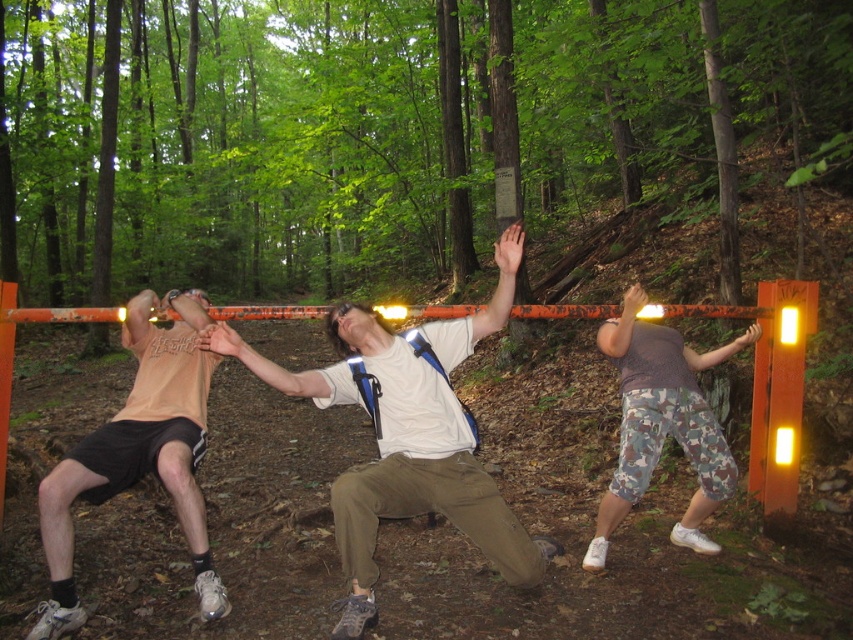
Question: Is matte peach t-shirt at left wider than camo pants at center?

Choices:
 (A) no
 (B) yes

Answer: (A)

Question: In this image, where is white matte t-shirt at center located relative to camo pants at center?

Choices:
 (A) below
 (B) above

Answer: (A)

Question: Is matte peach t-shirt at left to the right of camo pants at center from the viewer's perspective?

Choices:
 (A) yes
 (B) no

Answer: (B)

Question: Which object appears closest to the camera in this image?

Choices:
 (A) camo pants at center
 (B) white matte t-shirt at center
 (C) matte peach t-shirt at left

Answer: (B)

Question: Which of the following is the closest to the observer?

Choices:
 (A) (123, 483)
 (B) (376, 467)
 (C) (671, 365)

Answer: (B)

Question: Which object is positioned farthest from the camo pants at center?

Choices:
 (A) white matte t-shirt at center
 (B) matte peach t-shirt at left

Answer: (B)